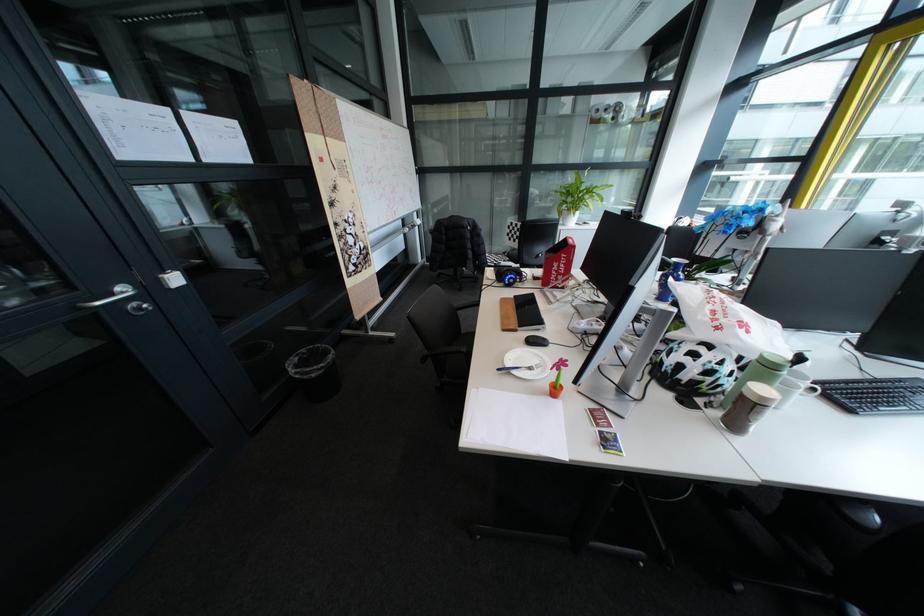
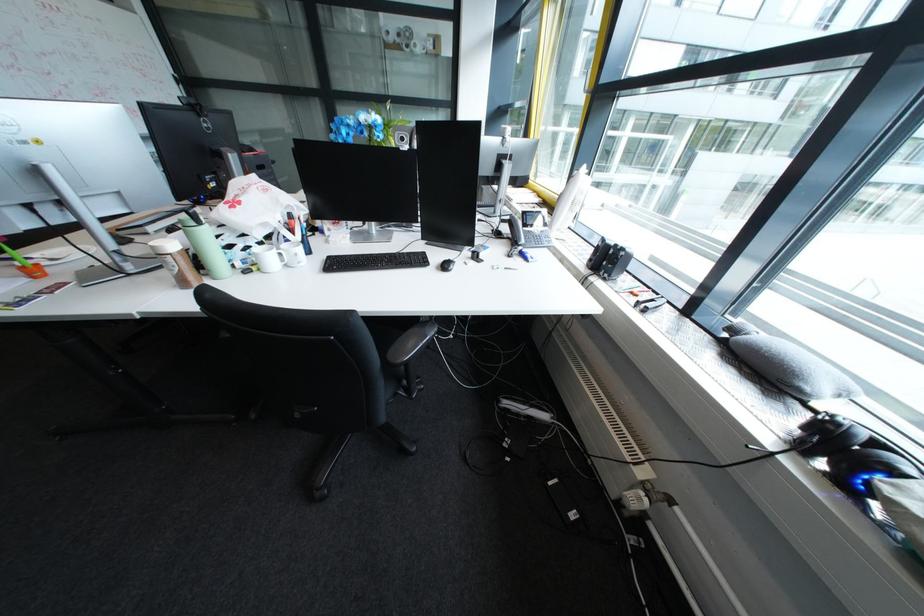
Question: The images are taken continuously from a first-person perspective. In which direction are you moving?

Choices:
 (A) Left
 (B) Right
 (C) Forward
 (D) Backward

Answer: (B)